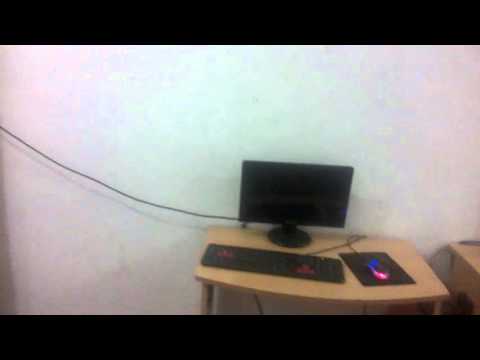
Locate an element on the screen. This screenshot has width=480, height=360. computer is located at coordinates [324, 205].